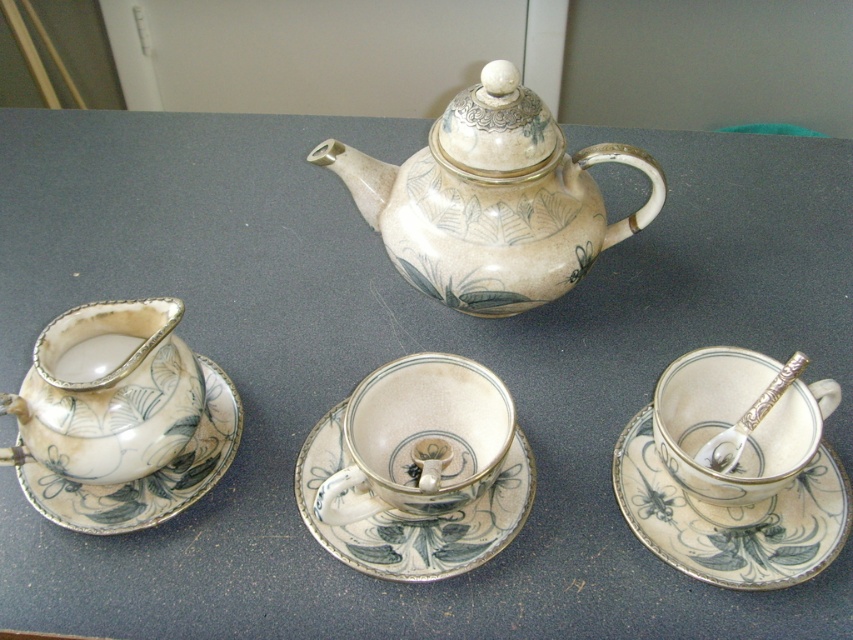
Is matte porcelain teacup at left shorter than white glossy teacup at center?

No.

Based on the photo, is matte porcelain teacup at left below white glossy teacup at center?

Incorrect, matte porcelain teacup at left is not positioned below white glossy teacup at center.

Describe the element at coordinates (109, 394) in the screenshot. I see `matte porcelain teacup at left` at that location.

Identify the location of matte porcelain teacup at left. Image resolution: width=853 pixels, height=640 pixels. (109, 394).

Is the position of matte porcelain teacup at left less distant than that of porcelain saucer at left?

Yes, matte porcelain teacup at left is in front of porcelain saucer at left.

Is matte porcelain teacup at left thinner than porcelain saucer at left?

Indeed, matte porcelain teacup at left has a lesser width compared to porcelain saucer at left.

Does point (45, 464) lie in front of point (78, 496)?

Yes, it is in front of point (78, 496).

I want to click on matte porcelain teacup at left, so click(x=109, y=394).

Which is more to the left, matte ceramic teapot at center or porcelain saucer at center?

From the viewer's perspective, porcelain saucer at center appears more on the left side.

Looking at this image, can you confirm if matte ceramic teapot at center is positioned below porcelain saucer at center?

Incorrect, matte ceramic teapot at center is not positioned below porcelain saucer at center.

The width and height of the screenshot is (853, 640). I want to click on matte ceramic teapot at center, so click(x=492, y=200).